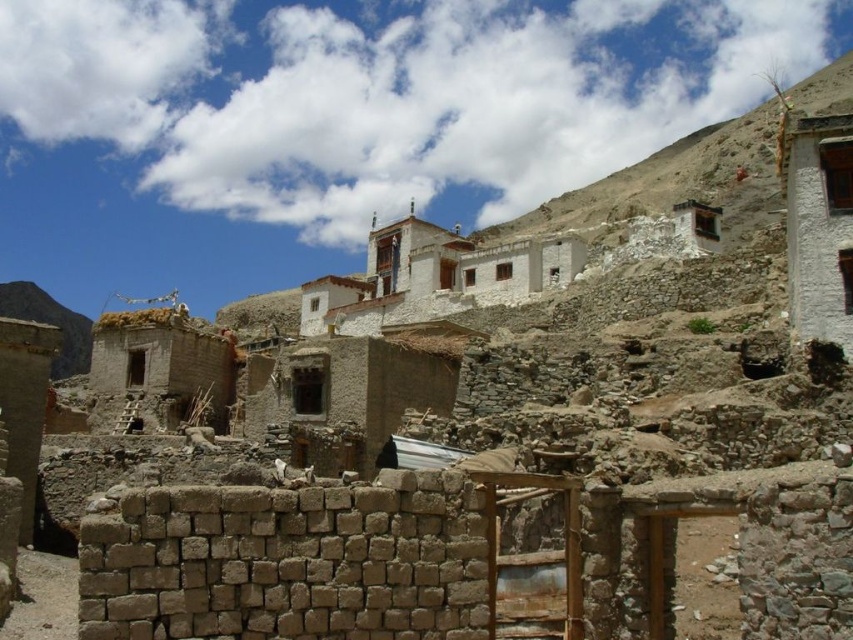
You are standing in the mountainous village scene and want to take a photo. You notice two points in the image labeled as point (694, 184) and point (33, 317). Which point is closer to your camera lens when capturing this scene?

Point (694, 184) is closer to the camera than point (33, 317).

You are a hiker who has just arrived at the village and wants to take a photo of the white stucco building at upper right and the brown stone wall at lower left. Which object should you focus on first to ensure both are in clear view?

You should focus on the white stucco building at upper right first because it is closer to you than the brown stone wall at lower left, so adjusting focus from near to far will help both be in clear view.